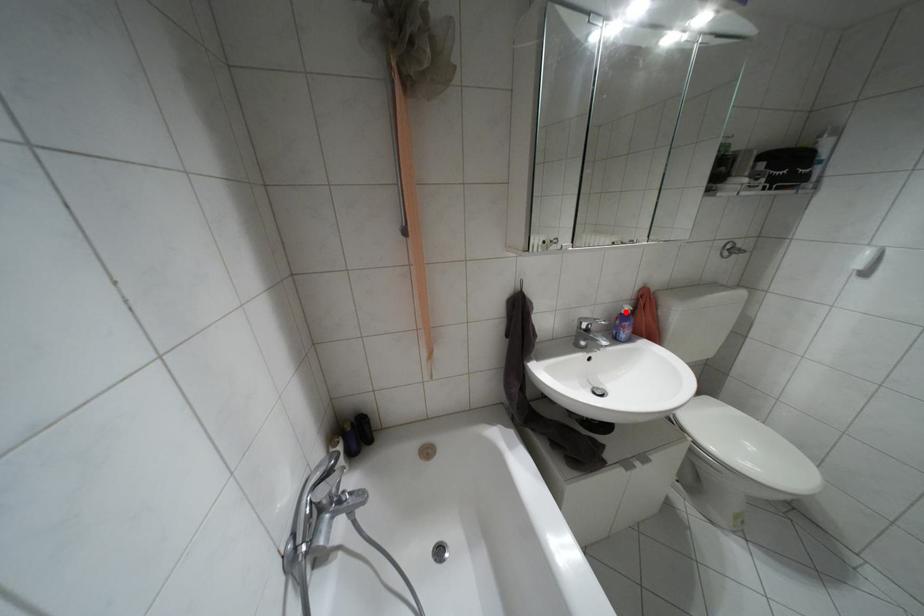
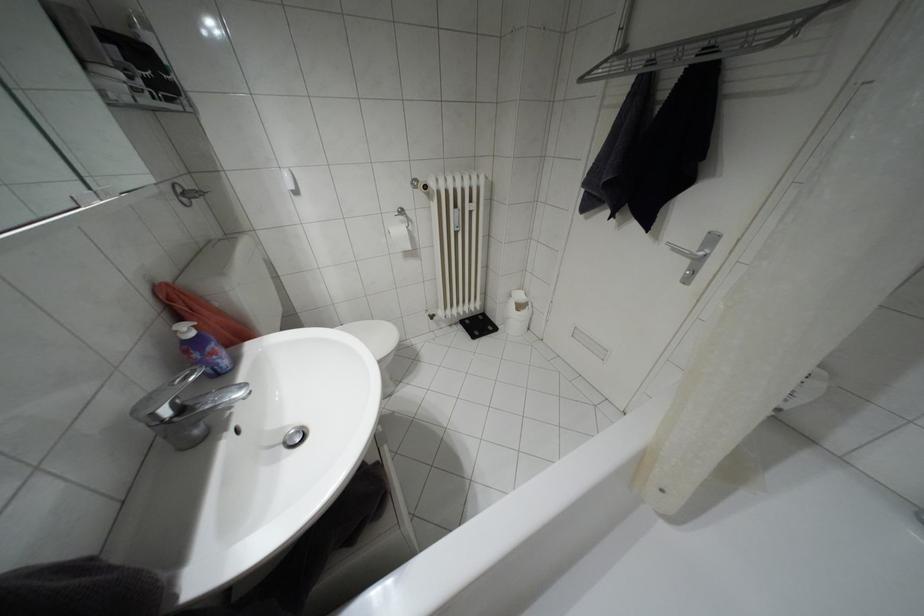
Where in the second image is the point corresponding to the highlighted location from the first image?

(190, 333)